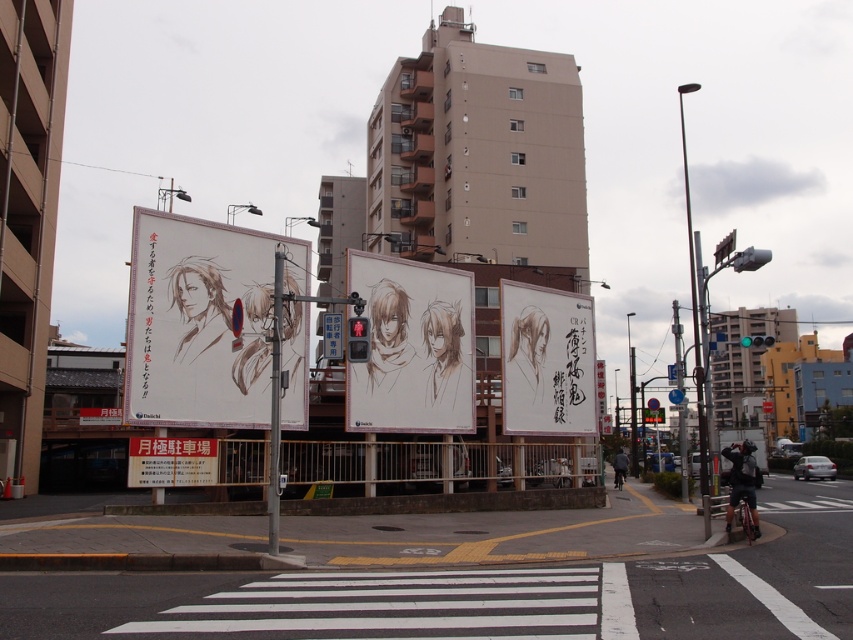
Does white paper billboard at center have a greater height compared to dark gray jacket at lower right?

Yes.

Which is behind, point (583, 396) or point (614, 470)?

The point (614, 470) is behind.

Does point (567, 396) come behind point (622, 452)?

No, it is not.

Where is `white paper billboard at center`? The height and width of the screenshot is (640, 853). white paper billboard at center is located at coordinates (546, 360).

Is the position of brown sketch at center more distant than that of white paper billboard at center?

No, brown sketch at center is in front of white paper billboard at center.

Is point (368, 410) positioned in front of point (535, 333)?

Yes, it is.

This screenshot has width=853, height=640. Describe the element at coordinates (412, 348) in the screenshot. I see `brown sketch at center` at that location.

This screenshot has width=853, height=640. Identify the location of brown sketch at center. (412, 348).

Between brown sketch at center and dark gray jacket at lower right, which one has less height?

dark gray jacket at lower right

Does point (463, 426) come in front of point (614, 483)?

Yes, it is.

Where is `brown sketch at center`? This screenshot has width=853, height=640. brown sketch at center is located at coordinates (x=412, y=348).